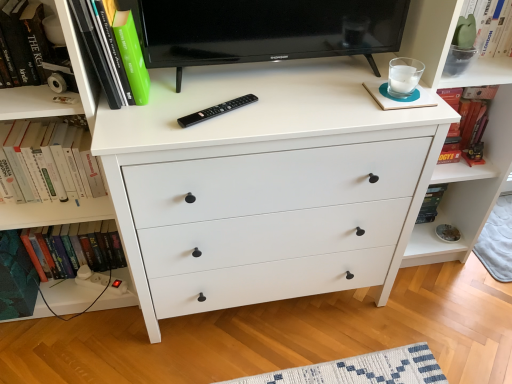
Find the location of `free space between black plastic remote at center and black glossy tv at upper center`. free space between black plastic remote at center and black glossy tv at upper center is located at coordinates (256, 98).